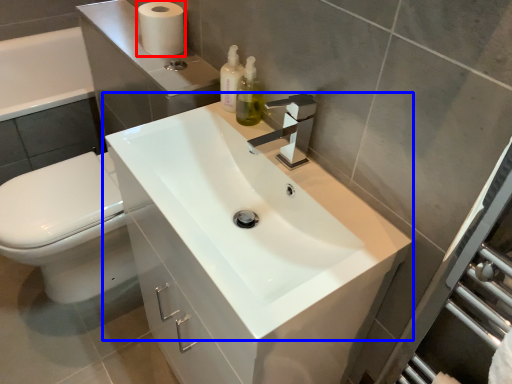
Question: Which point is closer to the camera, toilet paper (highlighted by a red box) or sink (highlighted by a blue box)?

Choices:
 (A) toilet paper
 (B) sink

Answer: (B)